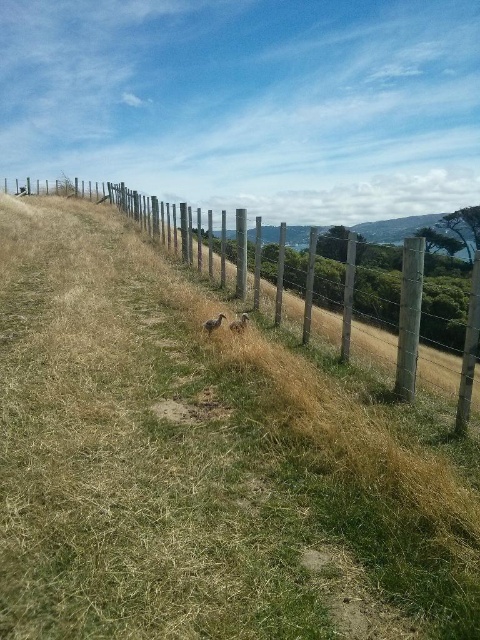
You are standing on the grassy path and see the wooden post fence at center and the brown fuzzy rabbit at center. Which object is closer to you?

The wooden post fence at center is closer to you because it is in front of the brown fuzzy rabbit at center.

You are a small animal trying to cross the path between the wooden post fence at center and the brown fuzzy bird at center. Can you fit through the space between them?

The wooden post fence at center might be wider than the brown fuzzy bird at center, so the space between them may not be wide enough for a small animal to pass through safely.

You are a photographer standing at the starting point of the grassy path. You want to take a closeup photo of the brown fuzzy bird at center. The camera you have can focus on objects up to 5 meters away. Will you be able to take the photo without moving closer?

The brown fuzzy bird at center is 4.97 meters away from the camera. Since the camera can focus up to 5 meters, you can take the closeup photo without moving closer.